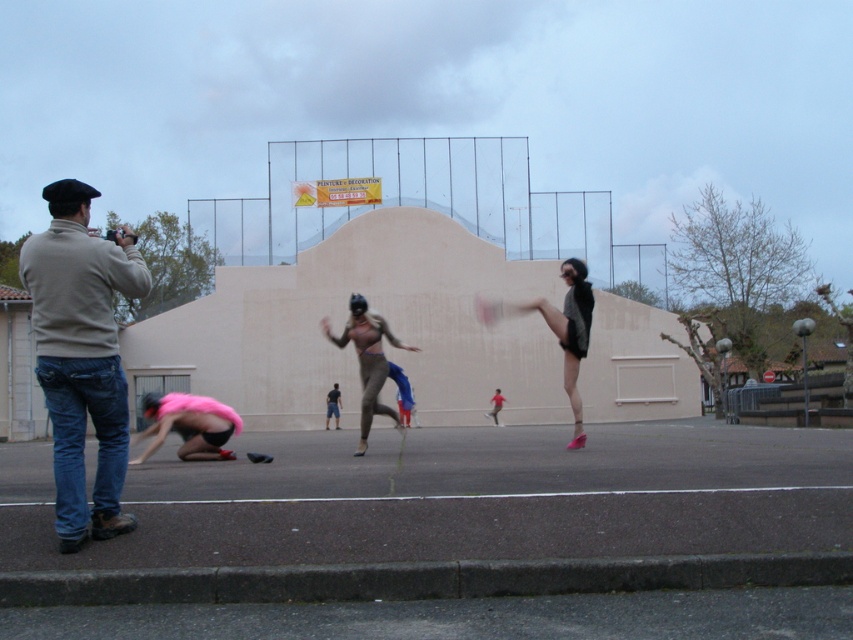
You are a photographer trying to capture the scene. The denim jeans at left and the matte black shorts at center are part of the subjects. Which subject should you zoom in on to focus on the wider lower body attire?

The matte black shorts at center should be zoomed in on because its width is greater than the denim jeans at left.

You are a photographer standing in the scene and want to take a photo of both the denim jeans at left and the matte black shorts at center. Which one should you focus on first to ensure both are in sharp focus?

You should focus on the denim jeans at left first because it is closer to you than the matte black shorts at center, so adjusting focus from near to far will help both be in sharp focus.

You are standing in the outdoor scene and want to take a photo of the denim jeans at left. Where should you position yourself to capture the best shot?

To capture the best shot of the denim jeans at left, position yourself directly in front of the denim jeans at left at point (80, 355).